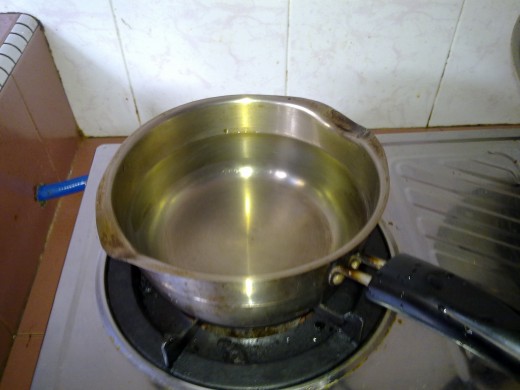
Locate an element on the screen. Image resolution: width=520 pixels, height=390 pixels. cooker is located at coordinates (429, 240).